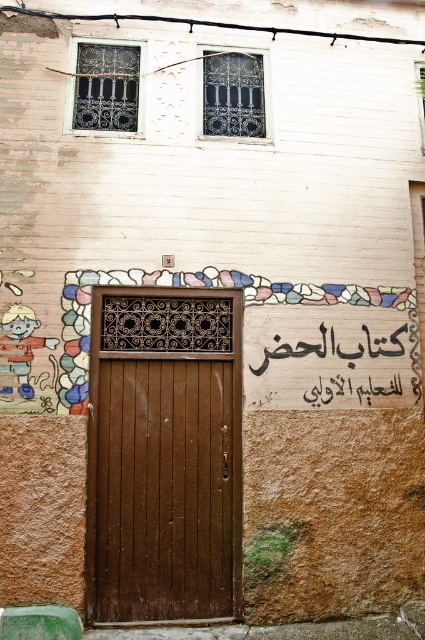
Between brown wooden door at center and wooden sign at center, which one has more height?

brown wooden door at center

Which is below, brown wooden door at center or wooden sign at center?

Positioned lower is brown wooden door at center.

What do you see at coordinates (164, 456) in the screenshot? I see `brown wooden door at center` at bounding box center [164, 456].

Identify the location of brown wooden door at center. The image size is (425, 640). (164, 456).